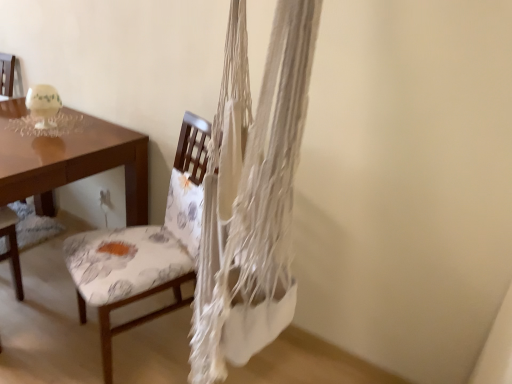
Question: Would you say floral fabric chair at left is to the left or to the right of brown glossy desk at left in the picture?

Choices:
 (A) left
 (B) right

Answer: (B)

Question: From a real-world perspective, is floral fabric chair at left physically located above or below brown glossy desk at left?

Choices:
 (A) above
 (B) below

Answer: (A)

Question: From the image's perspective, relative to brown glossy desk at left, is floral fabric chair at left above or below?

Choices:
 (A) above
 (B) below

Answer: (B)

Question: Relative to floral fabric chair at left, is brown glossy desk at left in front or behind?

Choices:
 (A) front
 (B) behind

Answer: (B)

Question: From the image's perspective, is brown glossy desk at left located above or below floral fabric chair at left?

Choices:
 (A) above
 (B) below

Answer: (A)

Question: From a real-world perspective, is brown glossy desk at left positioned above or below floral fabric chair at left?

Choices:
 (A) above
 (B) below

Answer: (B)

Question: Considering the relative positions of brown glossy desk at left and floral fabric chair at left in the image provided, is brown glossy desk at left to the left or to the right of floral fabric chair at left?

Choices:
 (A) right
 (B) left

Answer: (B)